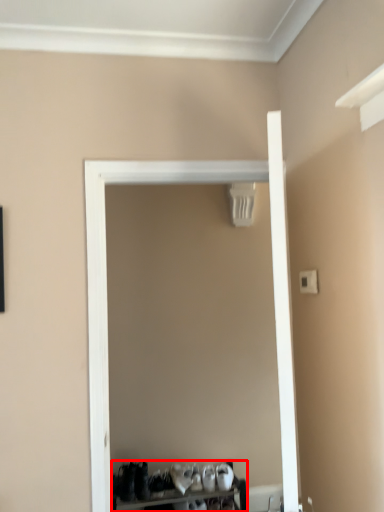
Question: Where is furniture (annotated by the red box) located in relation to door in the image?

Choices:
 (A) left
 (B) right

Answer: (A)